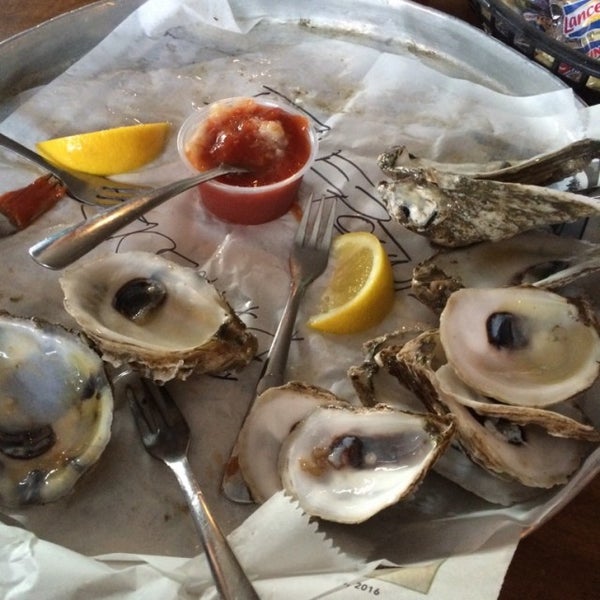
Find the location of `forks`. forks is located at coordinates (179, 438), (305, 265).